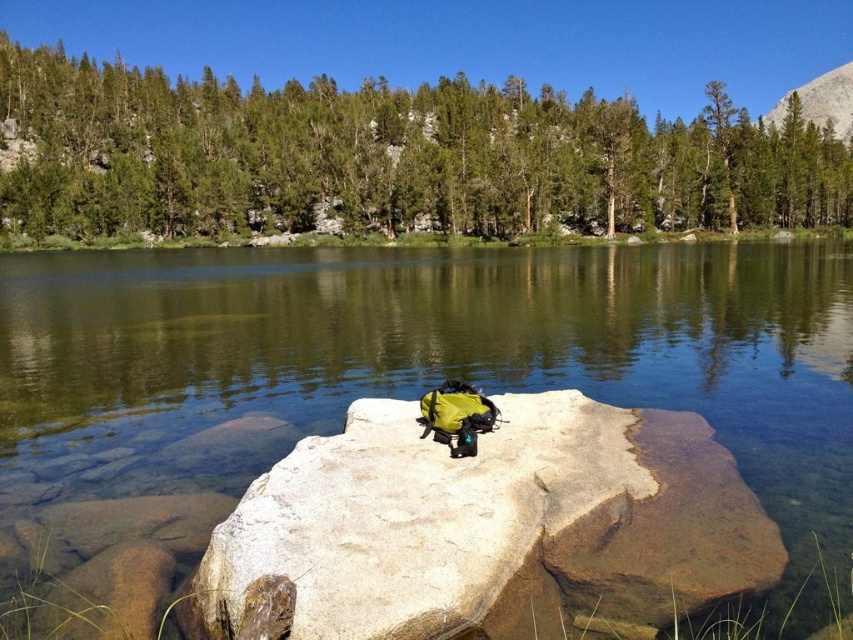
You are a hiker who wants to cross from the green matte rock at center to the smooth granite boulder at center. Can you safely walk between them without getting wet?

The distance between the green matte rock at center and the smooth granite boulder at center is 29.14 meters. Since the water between them is calm and reflective, there is no indication of a path or bridge, so walking between them would likely require wading through the water, which may get you wet.

You are a hiker who wants to cross the water to reach the forest. You have a 3m wide inflatable raft. The green matte rock at center and the smooth granite boulder at center are in your path. Can your raft fit between them?

The green matte rock at center is wider than the smooth granite boulder at center. Since the raft is 3m wide, you need to check the distance between the rocks. However, the description only compares their widths, not the space between them. Without knowing the distance between them, it is impossible to determine if the raft can fit.

You are standing at the center of the image and want to place a small flag at the point marked by the coordinates point (428,364). What object will the flag be placed on?

The flag will be placed on the green matte rock at center because point (428,364) corresponds to that object.